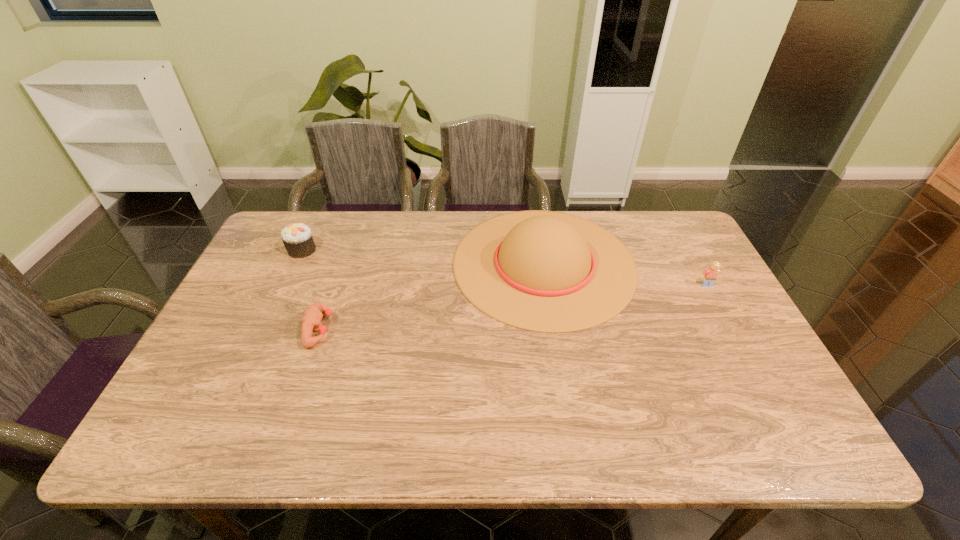
This screenshot has height=540, width=960. I want to click on the tallest object, so click(544, 271).

Locate an element on the screen. This screenshot has height=540, width=960. sombrero is located at coordinates coord(544,271).

Image resolution: width=960 pixels, height=540 pixels. Find the location of `cupcake`. cupcake is located at coordinates (297, 238).

At what (x,y) coordinates should I click in order to perform the action: click on the rightmost object. Please return your answer as a coordinate pair (x, y). The width and height of the screenshot is (960, 540). Looking at the image, I should click on (709, 276).

Locate an element on the screen. puncher is located at coordinates (311, 319).

The image size is (960, 540). Find the location of `the second object from left to right`. the second object from left to right is located at coordinates pos(311,319).

At what (x,y) coordinates should I click in order to perform the action: click on vacant space located 0.140m on the right of the second object from right to left. Please return your answer as a coordinate pair (x, y). Image resolution: width=960 pixels, height=540 pixels. Looking at the image, I should click on (680, 263).

Locate an element on the screen. blank space located 0.370m on the right of the leftmost object is located at coordinates (432, 250).

You are a GUI agent. You are given a task and a screenshot of the screen. Output one action in this format:
    pyautogui.click(x=<x>, y=<y>)
    Task: Click on the vacant area located 0.310m on the front-facing side of the rightmost object
    
    Given the screenshot: What is the action you would take?
    (x=757, y=378)

I want to click on vacant region located with the gloves of the puncher facing forward, so click(x=461, y=329).